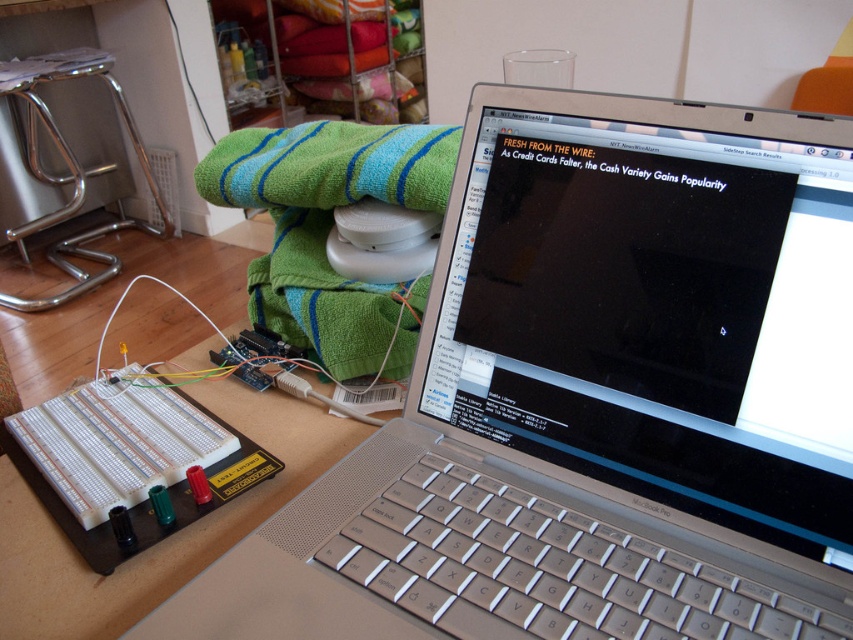
You are organizing the workspace and need to place a new item between the green striped towel at upper center and the white plastic breadboard at lower left. Considering their sizes, which object should be placed closer to the edge to ensure there is enough space for both?

The white plastic breadboard at lower left should be placed closer to the edge because the green striped towel at upper center is taller than the white plastic breadboard at lower left, so the shorter breadboard can be positioned near the edge while leaving enough space for the taller towel.

Based on the photo, you are an engineer working on the electronics project. You need to determine which point is closer to you when looking at the workspace. Which point is closer to the viewer between point (607, 404) and point (323, 253)?

Point (607, 404) is closer to the viewer than point (323, 253).